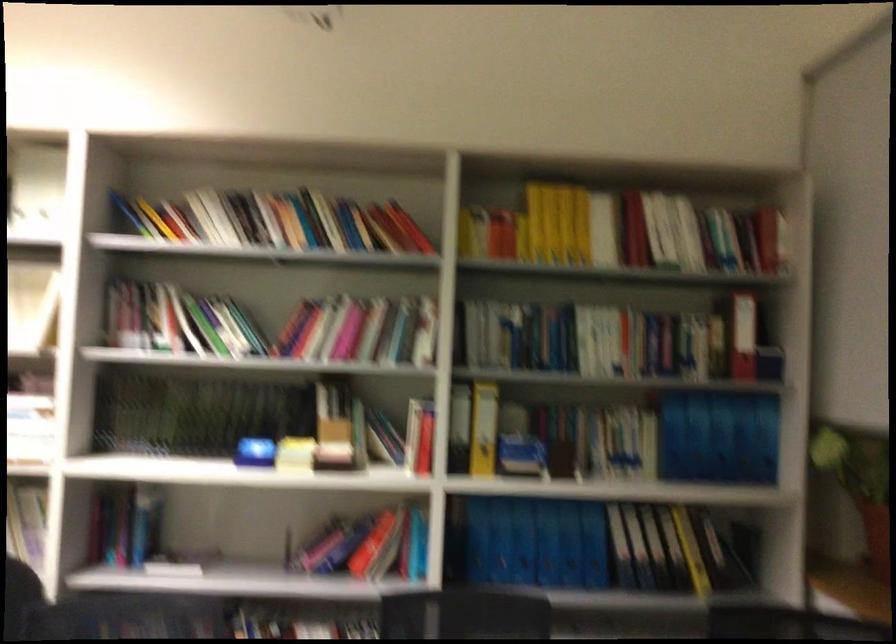
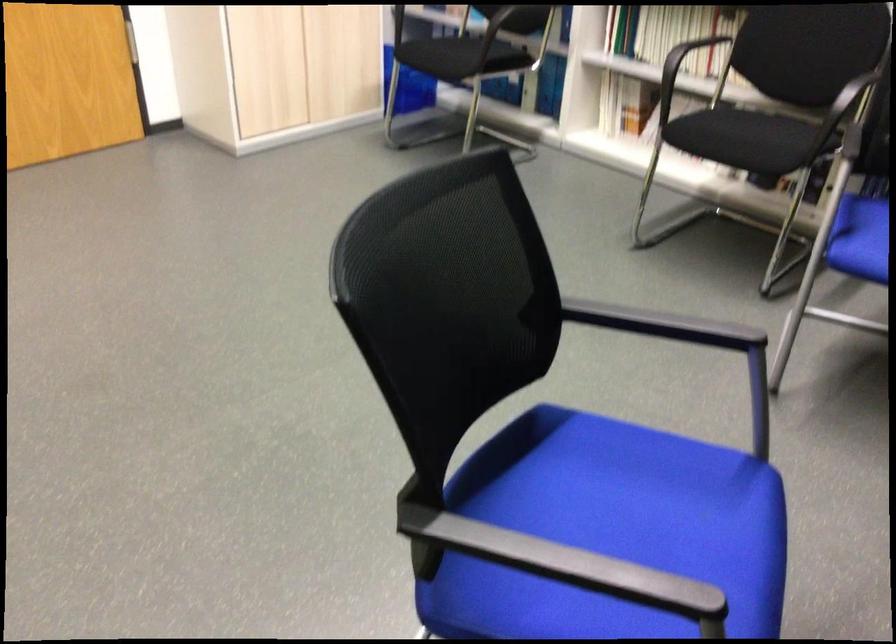
Based on the continuous images, in which direction is the camera rotating?

The rotation direction of the camera is left-down.